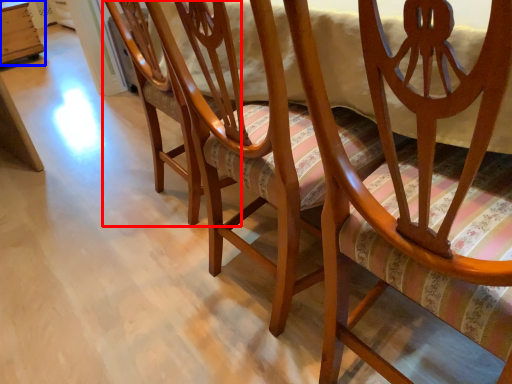
Question: Which object appears closest to the camera in this image, chair (highlighted by a red box) or table (highlighted by a blue box)?

Choices:
 (A) chair
 (B) table

Answer: (A)